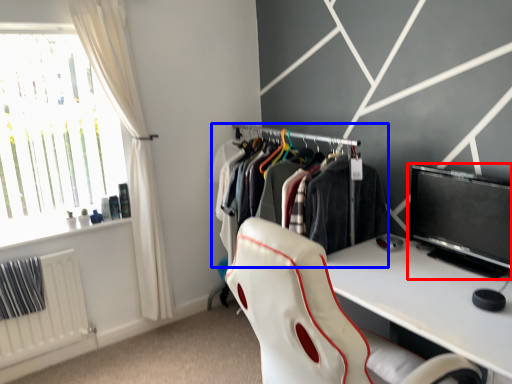
Question: Which object is further to the camera taking this photo, computer monitor (highlighted by a red box) or closet (highlighted by a blue box)?

Choices:
 (A) computer monitor
 (B) closet

Answer: (B)